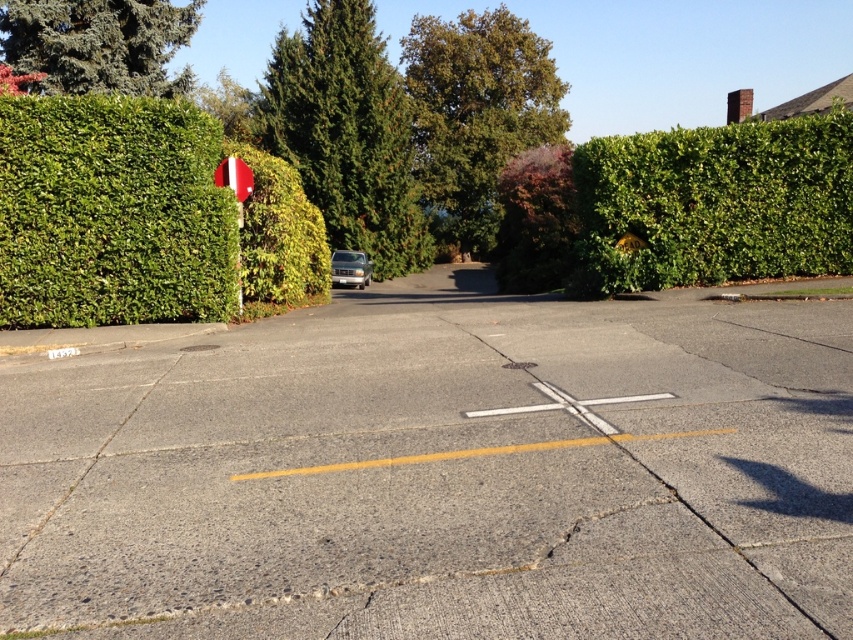
Is green leafy hedge at right below green leafy tree at center?

Yes, green leafy hedge at right is below green leafy tree at center.

Does green leafy hedge at right have a greater width compared to green leafy tree at center?

In fact, green leafy hedge at right might be narrower than green leafy tree at center.

Locate an element on the screen. The image size is (853, 640). green leafy hedge at right is located at coordinates (714, 204).

The height and width of the screenshot is (640, 853). What are the coordinates of `green leafy hedge at right` in the screenshot? It's located at (714, 204).

Does green leafy tree at center have a smaller size compared to metallic reflective sign at left?

No.

Between green leafy tree at center and metallic reflective sign at left, which one is positioned higher?

green leafy tree at center is higher up.

Is point (503, 61) positioned in front of point (241, 212)?

No, (503, 61) is further to viewer.

Identify the location of green leafy tree at center. (476, 115).

The height and width of the screenshot is (640, 853). I want to click on green leafy bush at left, so click(x=112, y=212).

Is green leafy bush at left taller than metallic pole at left?

Yes.

You are a GUI agent. You are given a task and a screenshot of the screen. Output one action in this format:
    pyautogui.click(x=<x>, y=<y>)
    Task: Click on the green leafy bush at left
    
    Given the screenshot: What is the action you would take?
    pyautogui.click(x=112, y=212)

Where is `green leafy bush at left`? The height and width of the screenshot is (640, 853). green leafy bush at left is located at coordinates (112, 212).